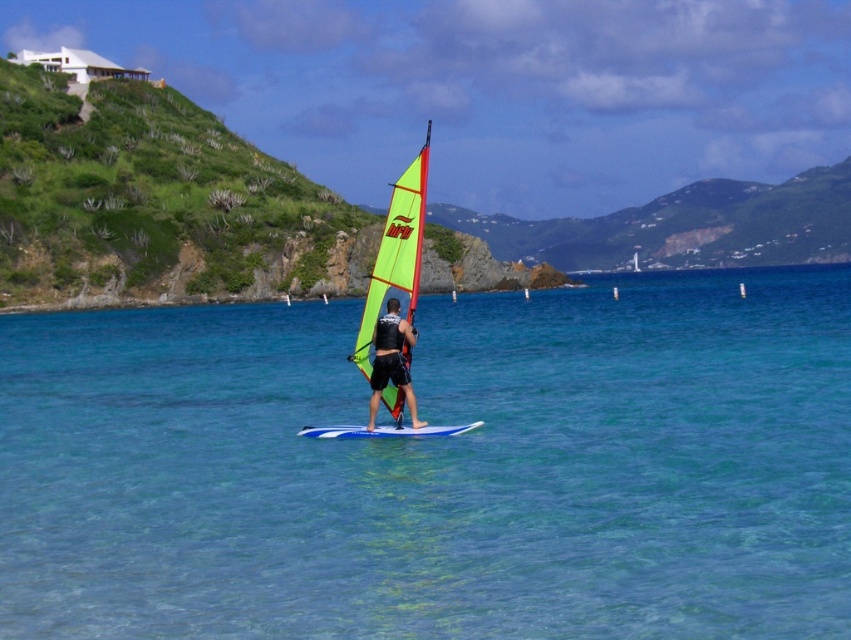
You are a safety inspector checking the windsurfer setup. Based on the image, is the blue glossy surfboard at center properly submerged in the clear blue water at center according to safety guidelines?

The clear blue water at center is above the blue glossy surfboard at center, meaning the surfboard is submerged in the water as required by safety guidelines.